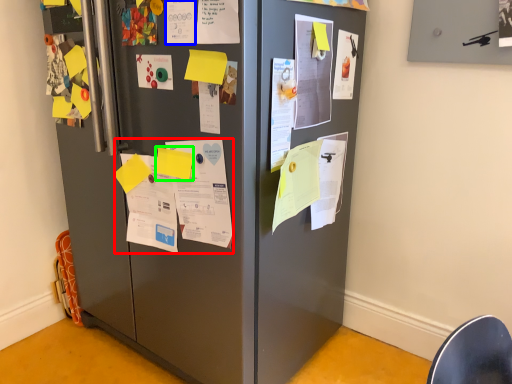
Question: Estimate the real-world distances between objects in this image. Which object is closer to poster (highlighted by a red box), poster (highlighted by a blue box) or paper (highlighted by a green box)?

Choices:
 (A) poster
 (B) paper

Answer: (B)